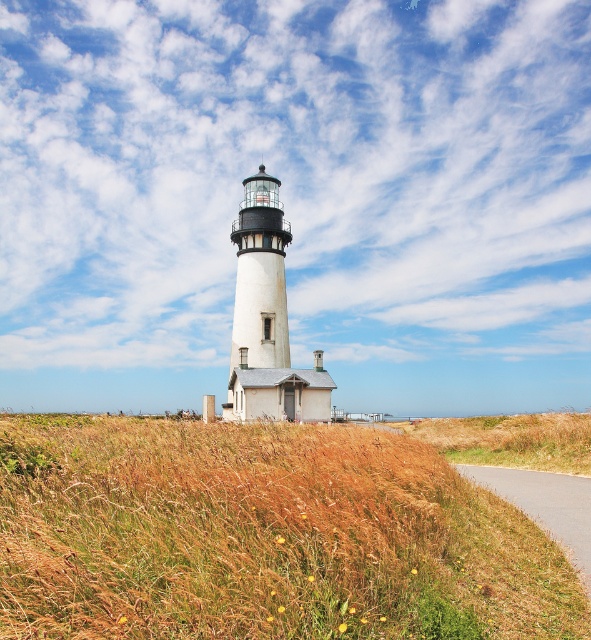
You are standing at the lighthouse and want to place a new navigation marker. You have two points to choose from on the map coordinates provided. Which point, point (x=131, y=509) or point (x=579, y=554), is closer to the lighthouse?

Point (x=131, y=509) is in front of point (x=579, y=554), so it is closer to the lighthouse.

You are standing at the bottom of the hill and see the brown dry grass at lower center. If you walk straight ahead, will you reach the lighthouse before the brown dry grass?

The brown dry grass at lower center is located at point (x=222, y=531) in the image, which is closer to the viewer than the lighthouse. Therefore, walking straight ahead, you would reach the brown dry grass at lower center before the lighthouse.